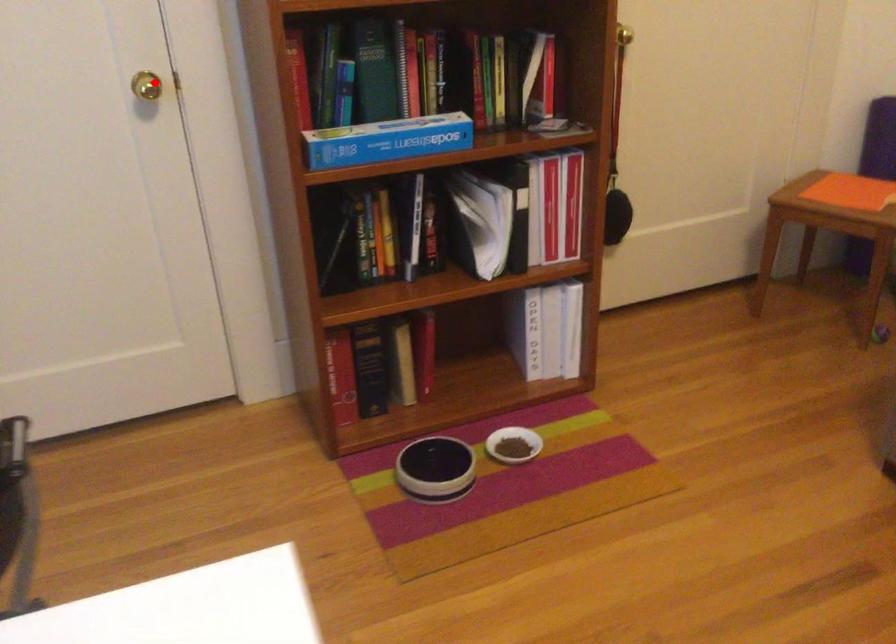
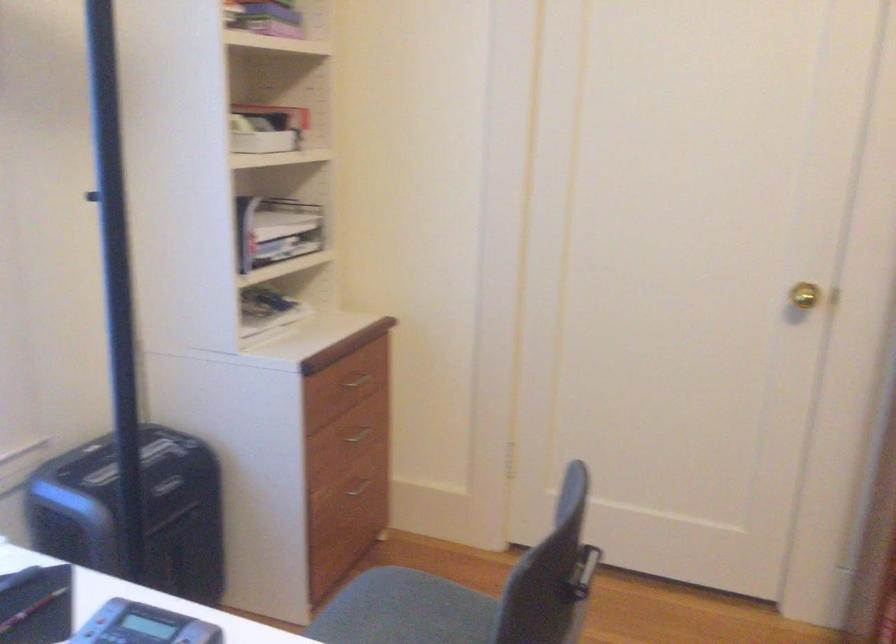
Where in the second image is the point corresponding to the highlighted location from the first image?

(804, 295)